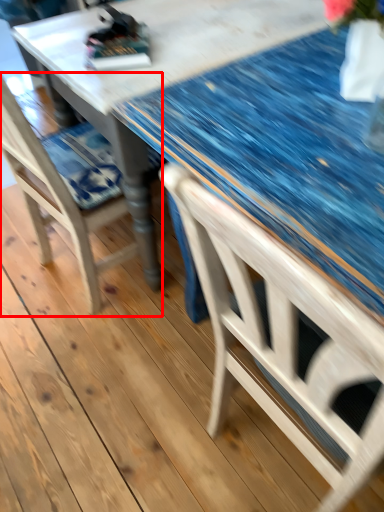
Question: From the image's perspective, what is the correct spatial relationship of chair (annotated by the red box) in relation to glass table?

Choices:
 (A) below
 (B) above

Answer: (A)